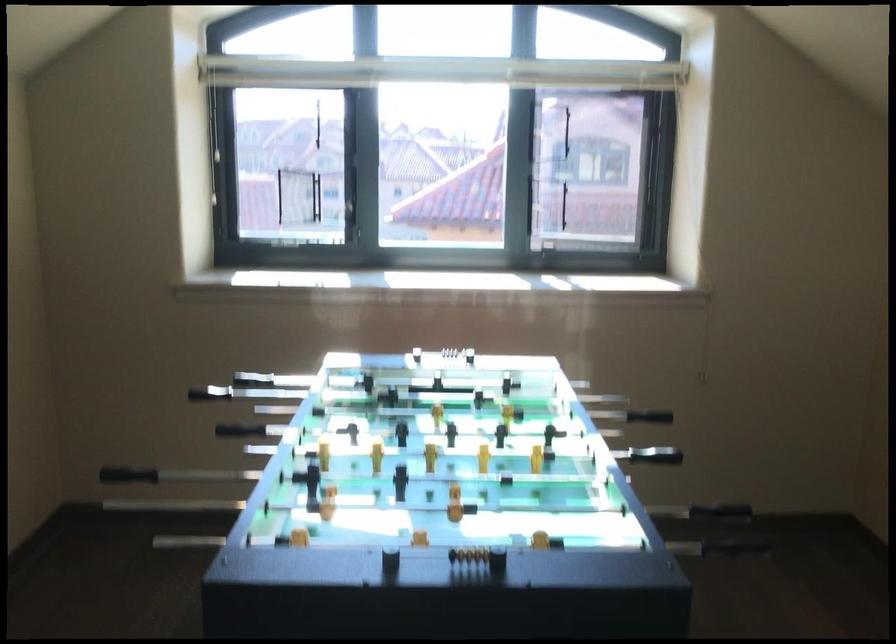
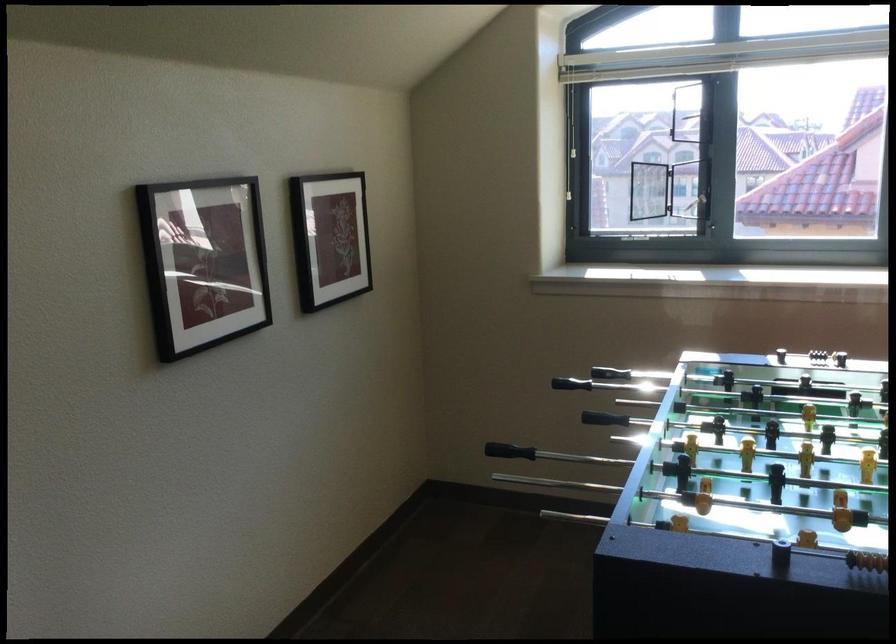
In the second image, find the point that corresponds to (248,431) in the first image.

(604, 419)